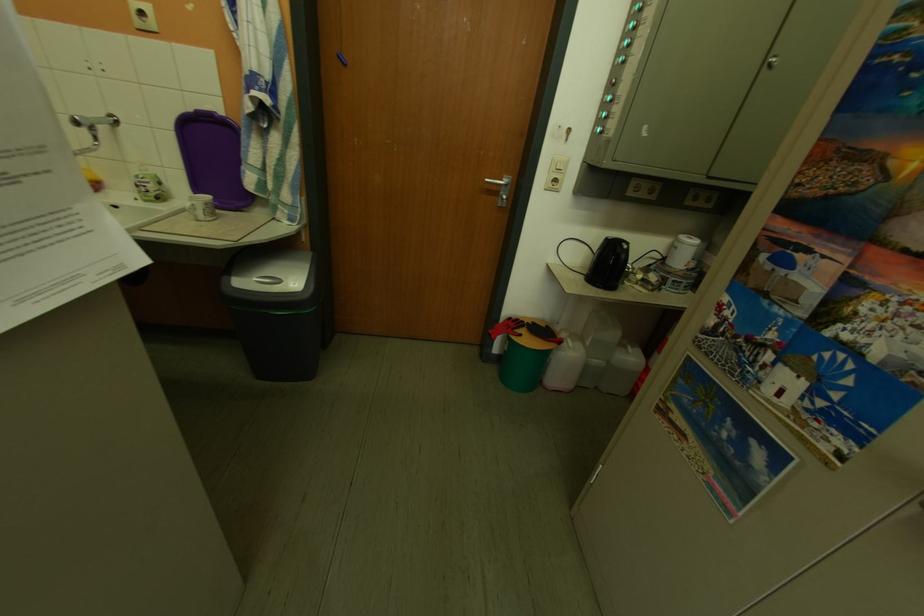
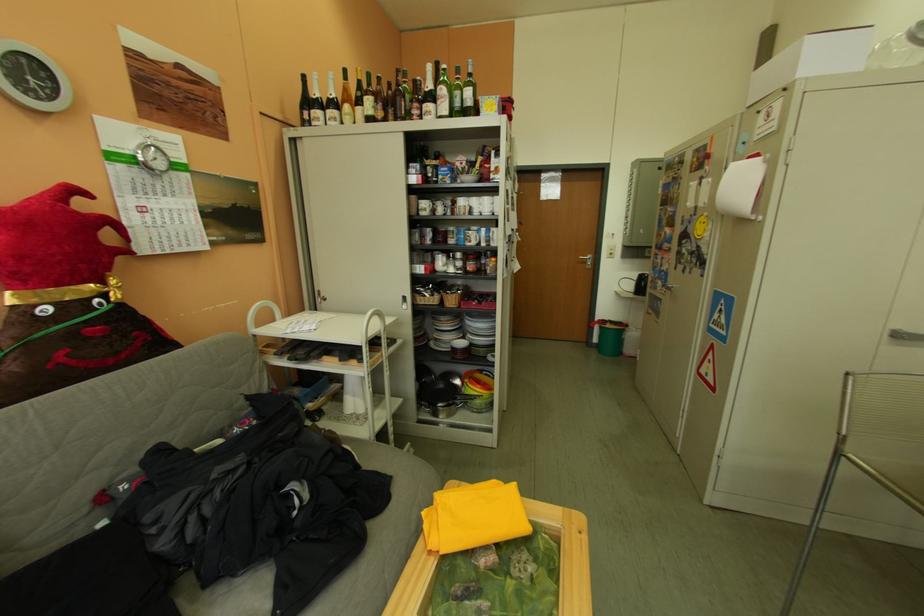
Where in the second image is the point corresponding to point 533,338 from the first image?

(617, 326)